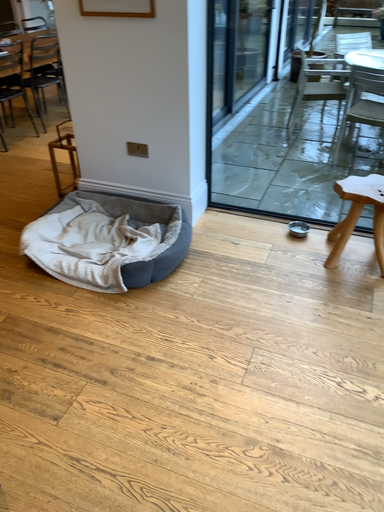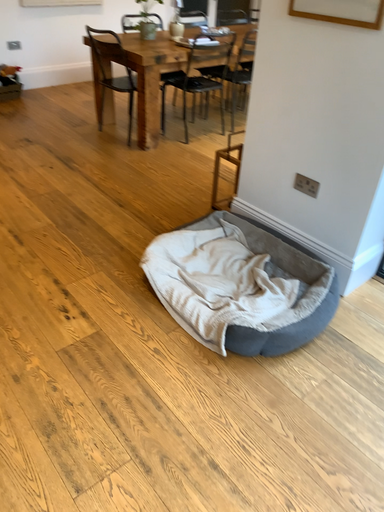
Question: Which way did the camera rotate in the video?

Choices:
 (A) rotated left
 (B) rotated right

Answer: (A)